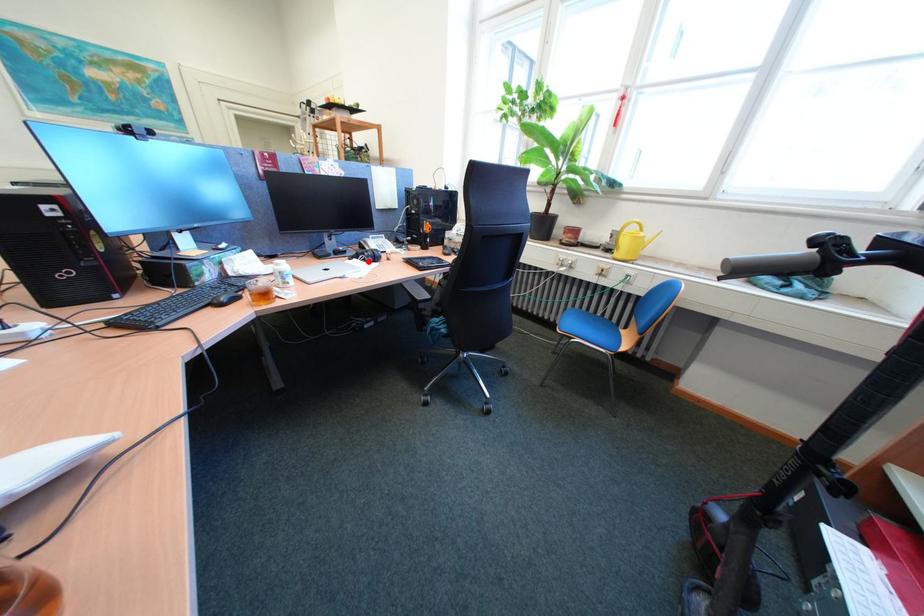
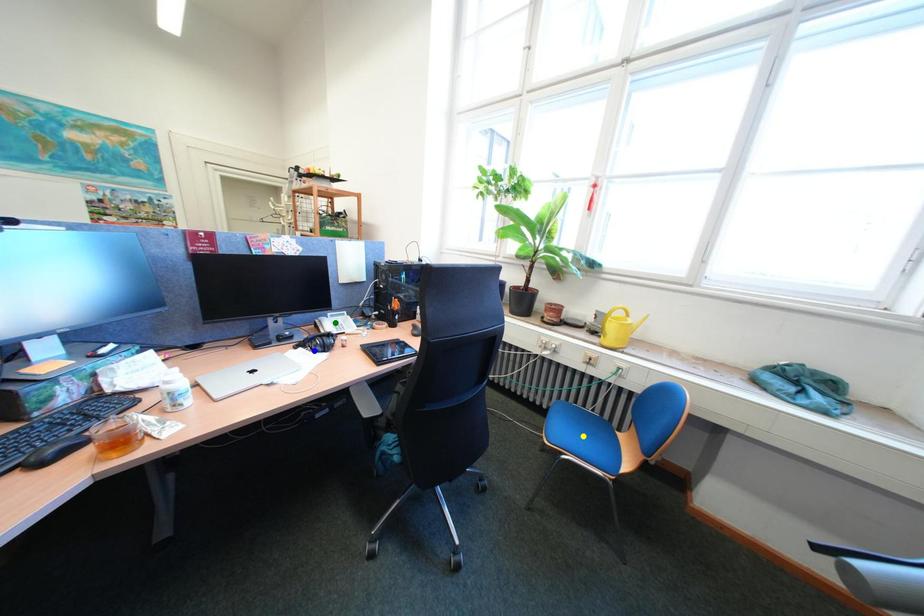
Question: I am providing you with two images of the same scene from different viewpoints. A red point is marked on the first image. You are given multiple points on the second image. Which mark in image 2 goes with the point in image 1?

Choices:
 (A) green point
 (B) blue point
 (C) yellow point

Answer: (B)